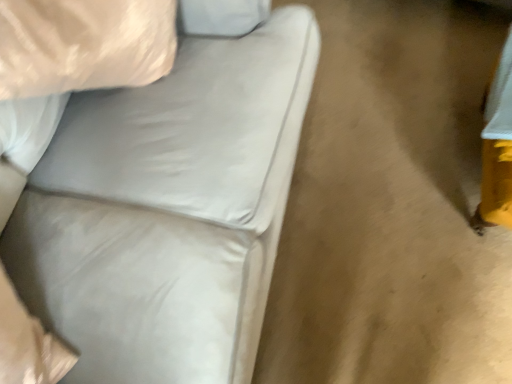
Where is `empty space that is ontop of suede-like gray couch at upper left (from a real-world perspective)`? The image size is (512, 384). empty space that is ontop of suede-like gray couch at upper left (from a real-world perspective) is located at coordinates (392, 145).